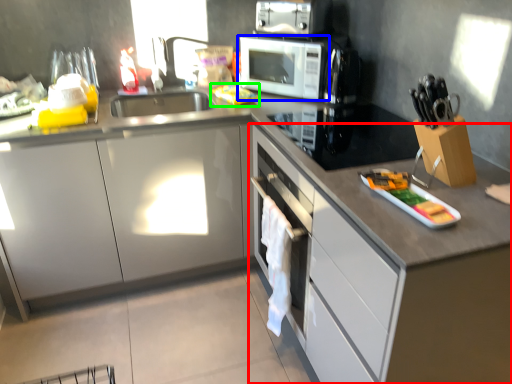
Question: Which object is positioned farthest from cabinetry (highlighted by a red box)? Select from home appliance (highlighted by a blue box) and food (highlighted by a green box).

Choices:
 (A) home appliance
 (B) food

Answer: (B)